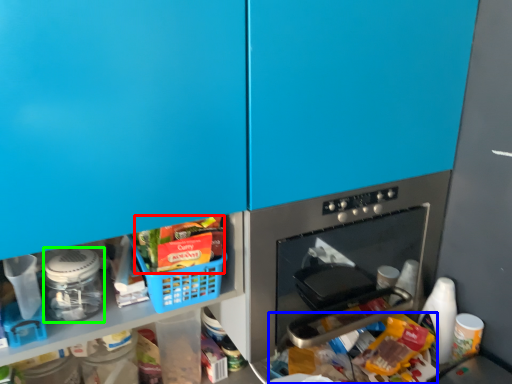
Question: Considering the real-world distances, which object is farthest from food (highlighted by a red box)? food (highlighted by a blue box) or appliance (highlighted by a green box)?

Choices:
 (A) food
 (B) appliance

Answer: (A)